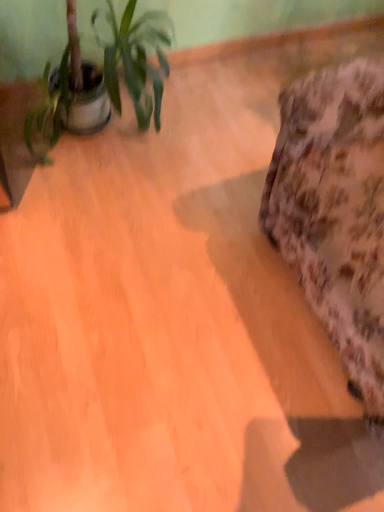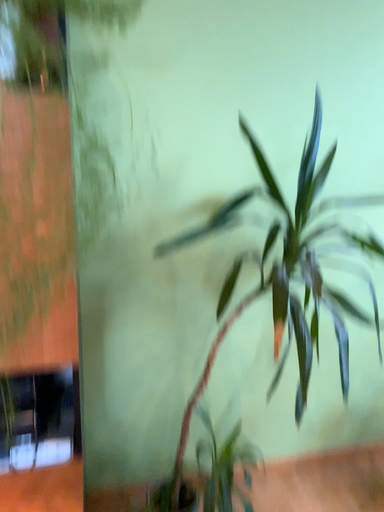
Question: How did the camera likely rotate when shooting the video?

Choices:
 (A) rotated upward
 (B) rotated downward

Answer: (A)